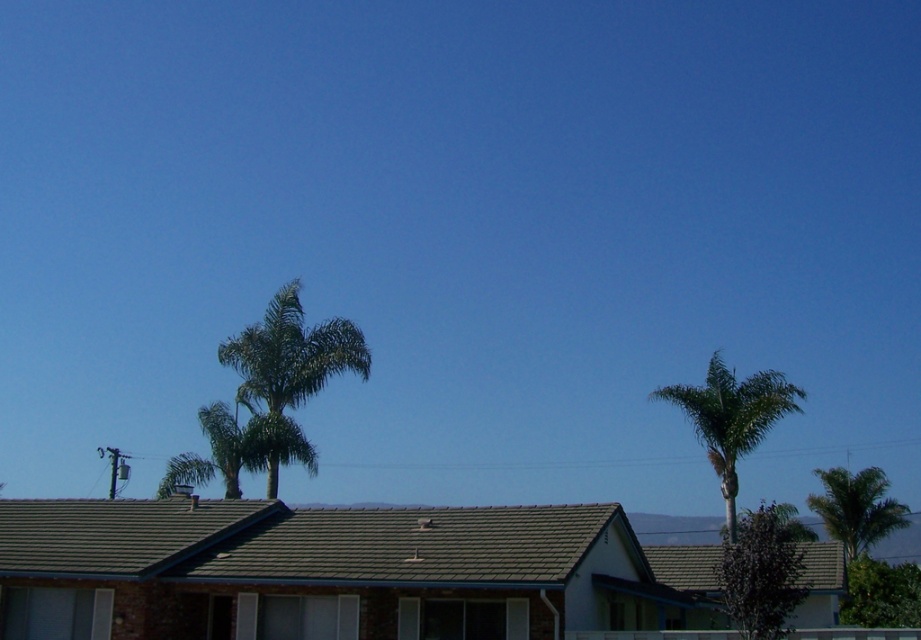
Does green leafy palm tree at center appear on the right side of green leafy palm tree at right?

Incorrect, green leafy palm tree at center is not on the right side of green leafy palm tree at right.

You are a GUI agent. You are given a task and a screenshot of the screen. Output one action in this format:
    pyautogui.click(x=<x>, y=<y>)
    Task: Click on the green leafy palm tree at center
    This screenshot has width=921, height=640.
    Given the screenshot: What is the action you would take?
    pyautogui.click(x=290, y=353)

Identify the location of green leafy palm tree at center. This screenshot has height=640, width=921. (290, 353).

Is green leafy tree at center wider than green leafy palm tree at right?

No.

Which is more to the left, green leafy tree at center or green leafy palm tree at right?

green leafy tree at center is more to the left.

Who is more forward, (801,570) or (907,518)?

Point (801,570) is in front.

I want to click on green leafy tree at center, so pos(761,572).

Who is positioned more to the left, green leafy palm tree at upper right or green leafy palm tree at right?

From the viewer's perspective, green leafy palm tree at upper right appears more on the left side.

Is green leafy palm tree at upper right above green leafy palm tree at right?

Yes, green leafy palm tree at upper right is above green leafy palm tree at right.

You are a GUI agent. You are given a task and a screenshot of the screen. Output one action in this format:
    pyautogui.click(x=<x>, y=<y>)
    Task: Click on the green leafy palm tree at upper right
    The height and width of the screenshot is (640, 921).
    Given the screenshot: What is the action you would take?
    pyautogui.click(x=731, y=419)